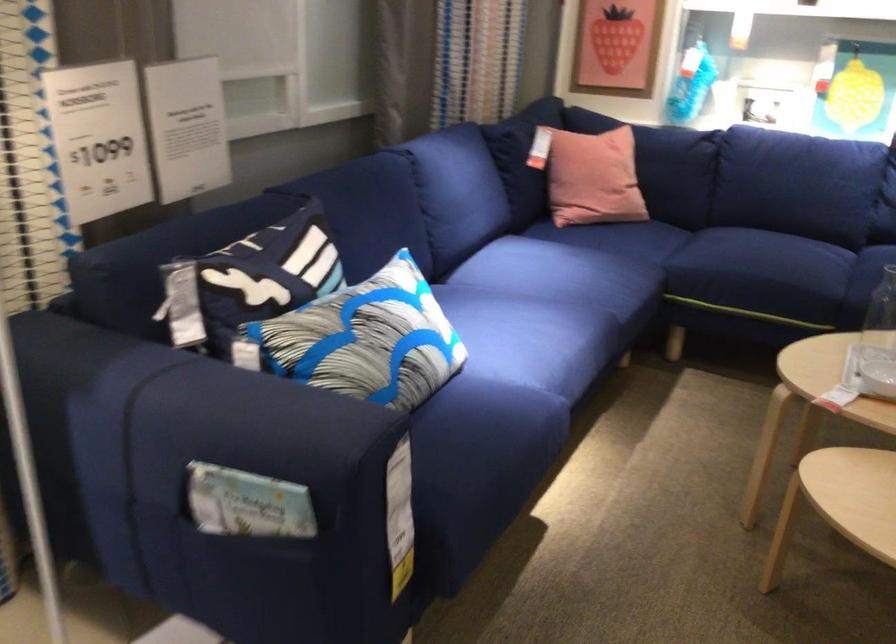
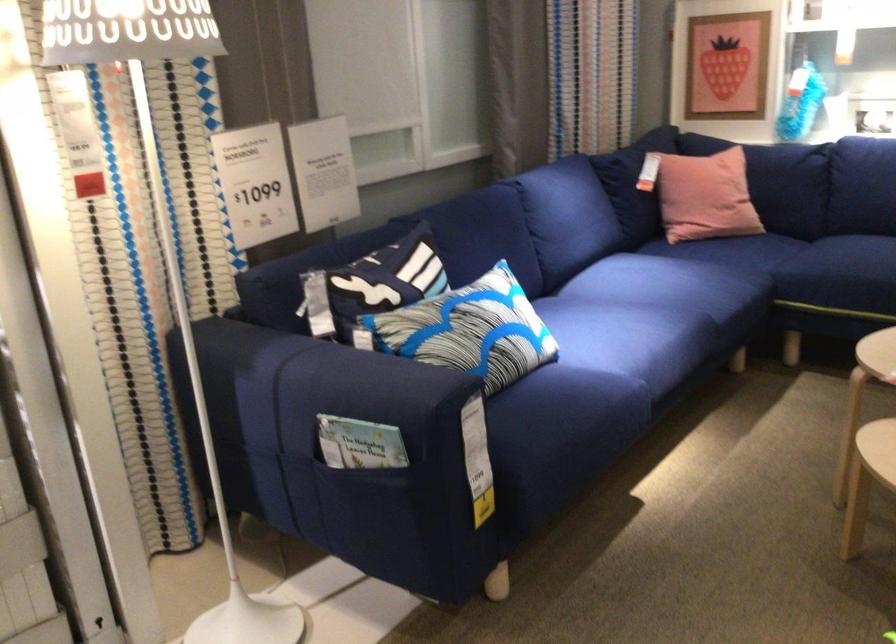
Locate, in the second image, the point that corresponds to the point at 252,498 in the first image.

(359, 444)